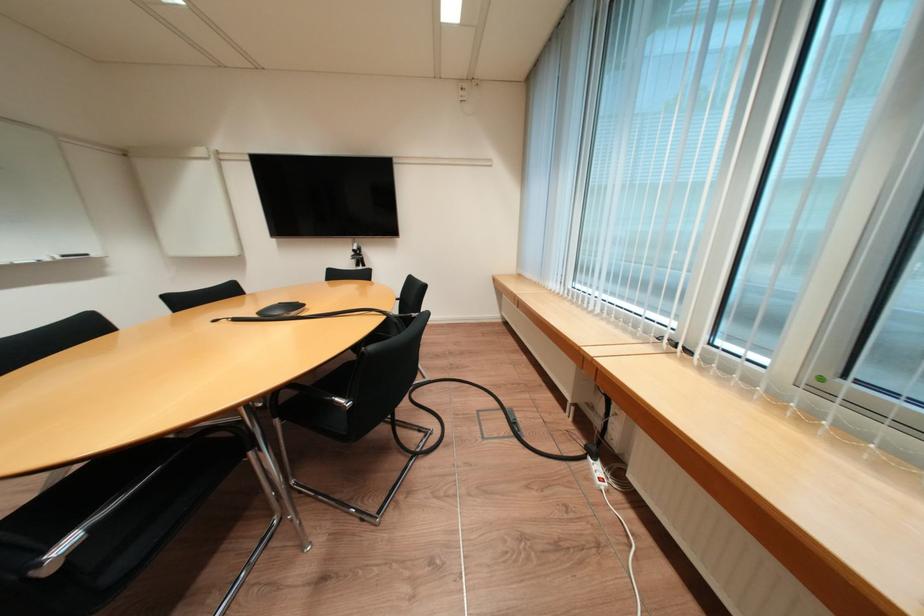
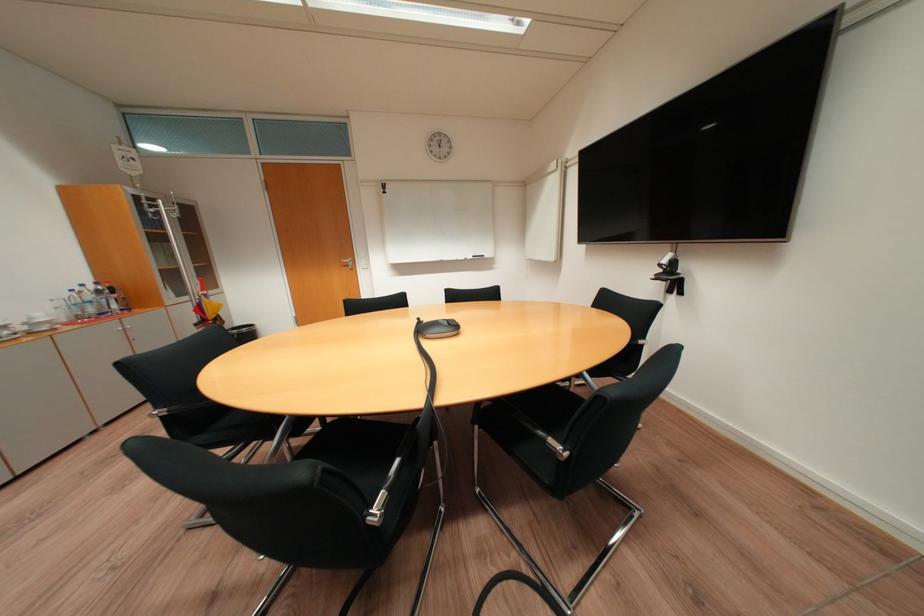
Where in the second image is the point corresponding to point 363,249 from the first image?

(673, 262)